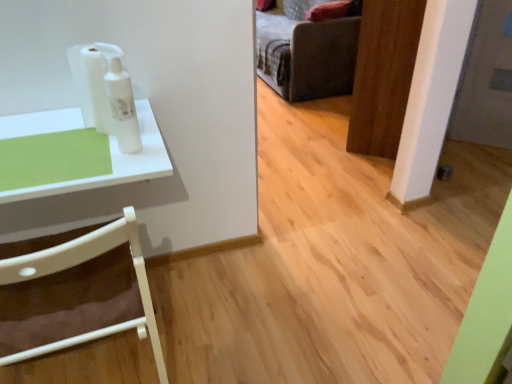
You are a GUI agent. You are given a task and a screenshot of the screen. Output one action in this format:
    pyautogui.click(x=<x>, y=<y>)
    Task: Click on the free spot to the left of white glossy lotion at upper left
    The width and height of the screenshot is (512, 384).
    Given the screenshot: What is the action you would take?
    pyautogui.click(x=68, y=153)